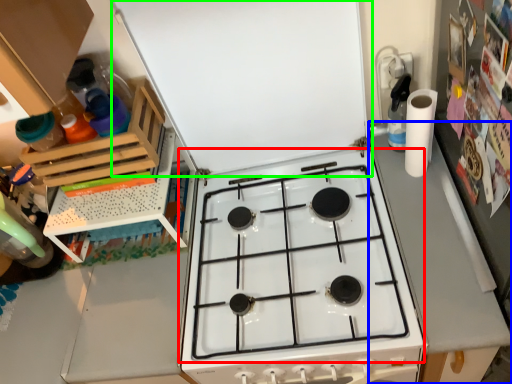
Question: Which object is positioned farthest from gas stove (highlighted by a red box)? Select from counter top (highlighted by a blue box) and exhaust hood (highlighted by a green box).

Choices:
 (A) counter top
 (B) exhaust hood

Answer: (B)